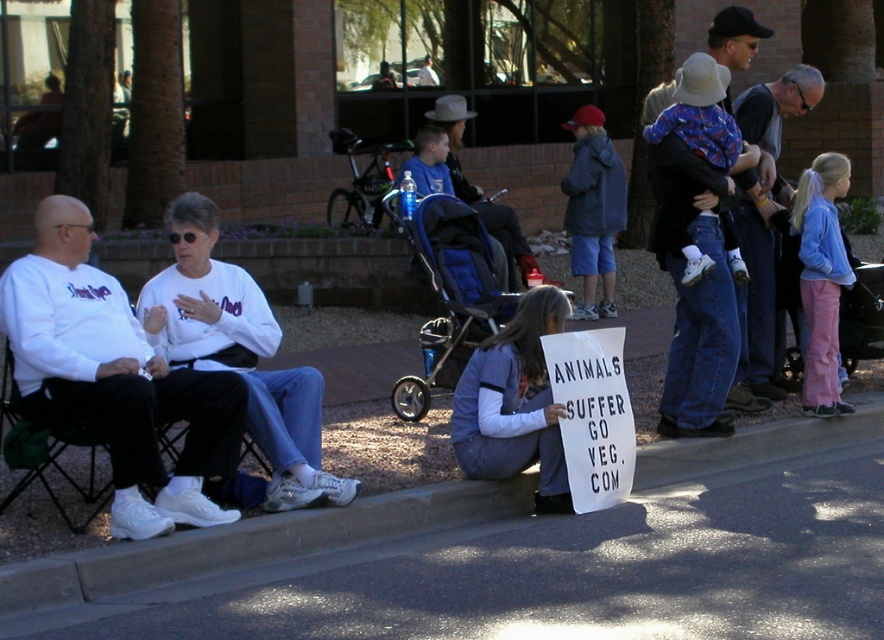
Is denim jacket at lower center taller than blue denim jacket at center?

No, denim jacket at lower center is not taller than blue denim jacket at center.

Describe the element at coordinates (513, 403) in the screenshot. I see `denim jacket at lower center` at that location.

Who is more distant from viewer, (494, 394) or (593, 109)?

The point (593, 109) is more distant.

Locate an element on the screen. Image resolution: width=884 pixels, height=640 pixels. denim jacket at lower center is located at coordinates (513, 403).

Which is in front, point (659, 260) or point (508, 467)?

Positioned in front is point (508, 467).

Describe the element at coordinates (696, 292) in the screenshot. This screenshot has height=640, width=884. I see `denim jeans at center` at that location.

Does point (742, 54) lie behind point (467, 396)?

Yes, it is behind point (467, 396).

Identify the location of denim jeans at center. The height and width of the screenshot is (640, 884). (696, 292).

Is gray asphalt pavement at lower center shorter than gray knit sweater at upper right?

Yes, gray asphalt pavement at lower center is shorter than gray knit sweater at upper right.

Is gray asphalt pavement at lower center further to the viewer compared to gray knit sweater at upper right?

No, it is in front of gray knit sweater at upper right.

Find the location of `gray asphalt pavement at lower center`. gray asphalt pavement at lower center is located at coordinates (530, 557).

Identify the location of gray asphalt pavement at lower center. This screenshot has width=884, height=640. (530, 557).